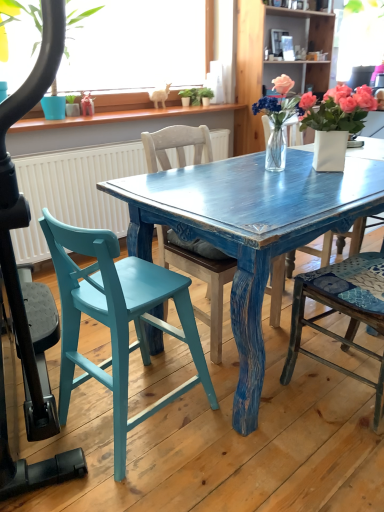
Question: Is wooden chair at right, placed as the first chair when sorted from right to left, inside or outside of clear glass vase at center, the second houseplant from the left?

Choices:
 (A) outside
 (B) inside

Answer: (A)

Question: Looking at their shapes, would you say wooden chair at right, the 3th chair when ordered from left to right, is wider or thinner than clear glass vase at center, the second houseplant in the right-to-left sequence?

Choices:
 (A) wide
 (B) thin

Answer: (A)

Question: Estimate the real-world distances between objects in this image. Which object is closer to the white ceramic vase at upper center?

Choices:
 (A) teal painted wood chair at left, which is counted as the third chair, starting from the right
 (B) green matte plant at upper left, the third houseplant in the right-to-left sequence
 (C) white ceramic vase at upper right, the 3th houseplant from the left
 (D) wooden chair at center, which appears as the second chair when viewed from the left
 (E) clear glass vase at center, the second houseplant from the left

Answer: (E)

Question: Which of these objects is positioned farthest from the wooden chair at center, which appears as the second chair when viewed from the left?

Choices:
 (A) green matte plant at upper left, the third houseplant in the right-to-left sequence
 (B) pink matte flower at upper right
 (C) white ceramic vase at upper center
 (D) white ceramic vase at upper right, the 1th houseplant positioned from the right
 (E) wooden chair at right, the 3th chair when ordered from left to right

Answer: (C)